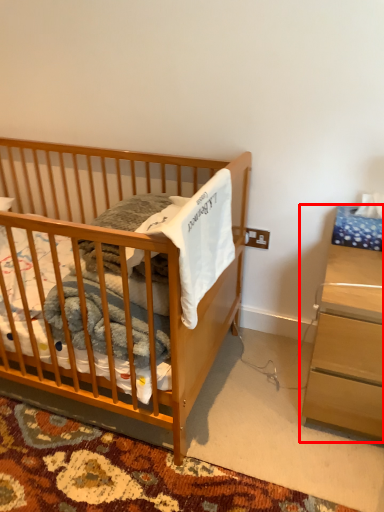
Question: From the image's perspective, what is the correct spatial relationship of nightstand (annotated by the red box) in relation to infant bed?

Choices:
 (A) below
 (B) above

Answer: (A)